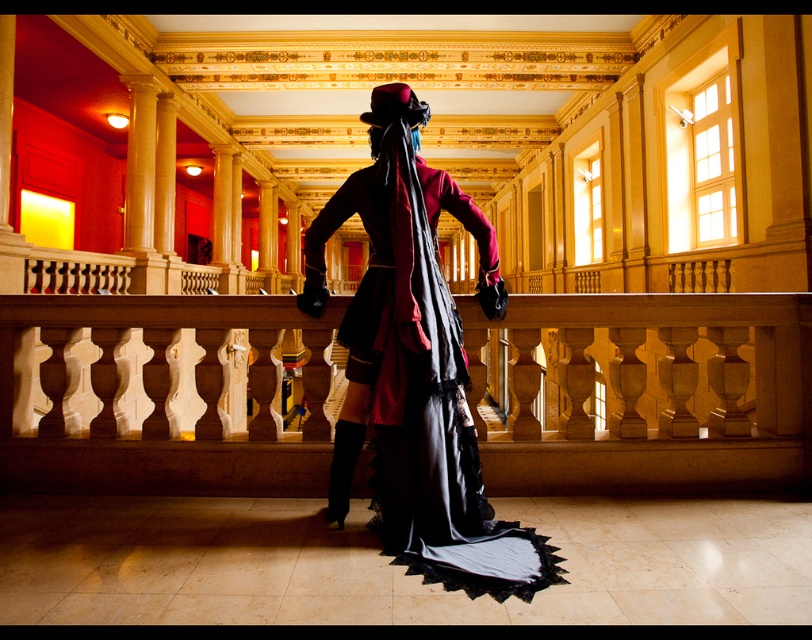
You are standing on the balcony and want to lean against the wooden balustrade at center. Based on its position, can you reach it without moving from your current spot?

The wooden balustrade at center is located at point (648,392), so yes, you can reach it without moving from your current spot as it is positioned within your reach.

You are a guest at an event and need to place your velvet maroon coat at center on the wooden balustrade at center. Based on the scene description, will the coat fit on the balustrade?

The wooden balustrade at center is thinner than the velvet maroon coat at center, so the coat will not fit on the balustrade because it is wider than the balustrade.